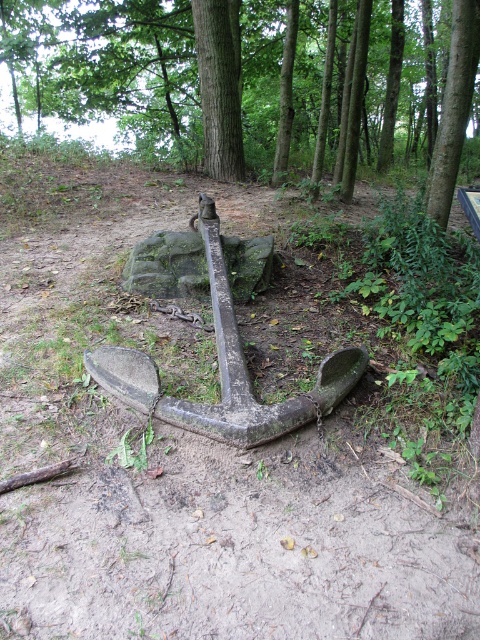
Looking at this image, is green rough bark tree at center shorter than green mossy rock at center?

Correct, green rough bark tree at center is not as tall as green mossy rock at center.

Who is lower down, green rough bark tree at center or green mossy rock at center?

green mossy rock at center is below.

What do you see at coordinates (256, 81) in the screenshot? The width and height of the screenshot is (480, 640). I see `green rough bark tree at center` at bounding box center [256, 81].

This screenshot has height=640, width=480. What are the coordinates of `green rough bark tree at center` in the screenshot? It's located at (256, 81).